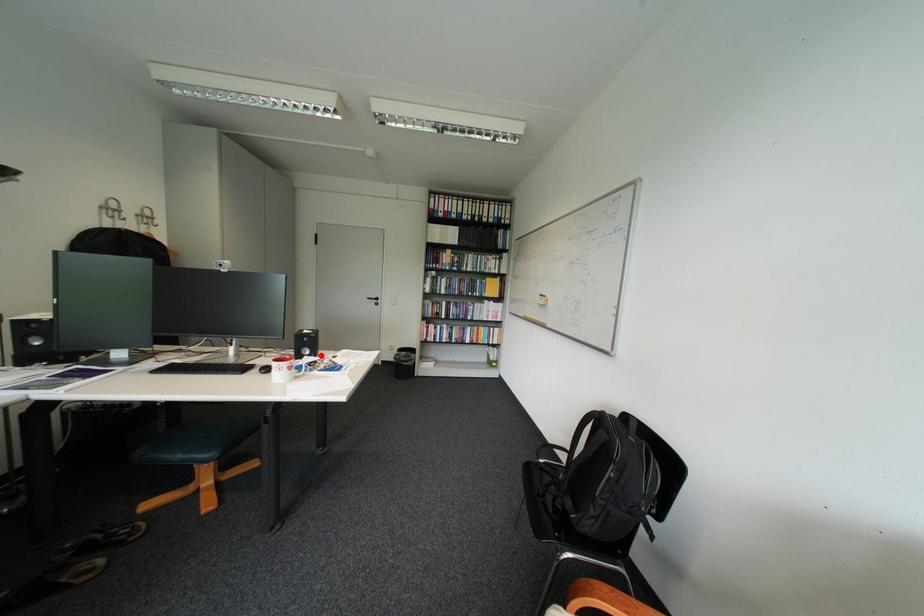
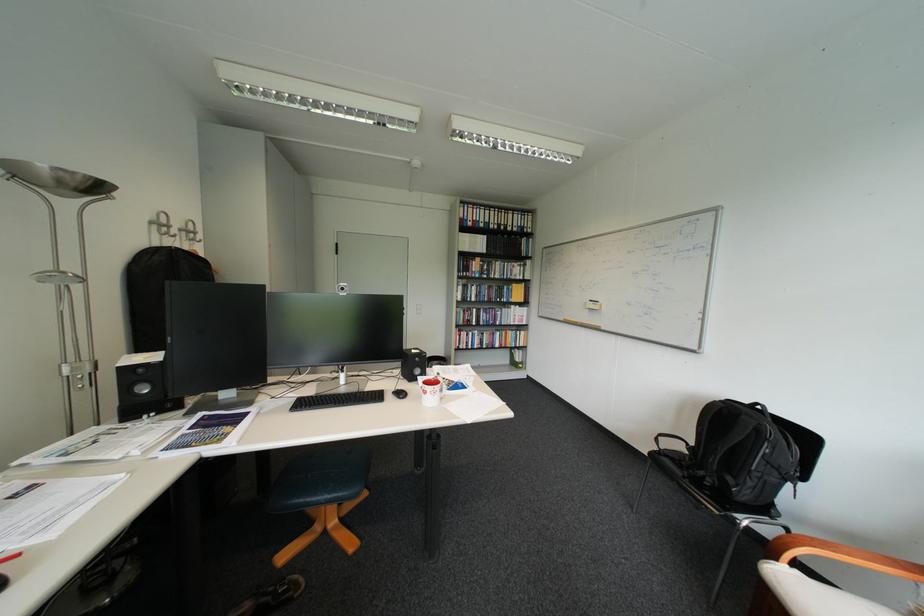
Question: I am providing you with two images of the same scene from different viewpoints. Given a red point in image1, look at the same physical point in image2. Is it:

Choices:
 (A) Closer to the viewpoint
 (B) Farther from the viewpoint

Answer: (A)